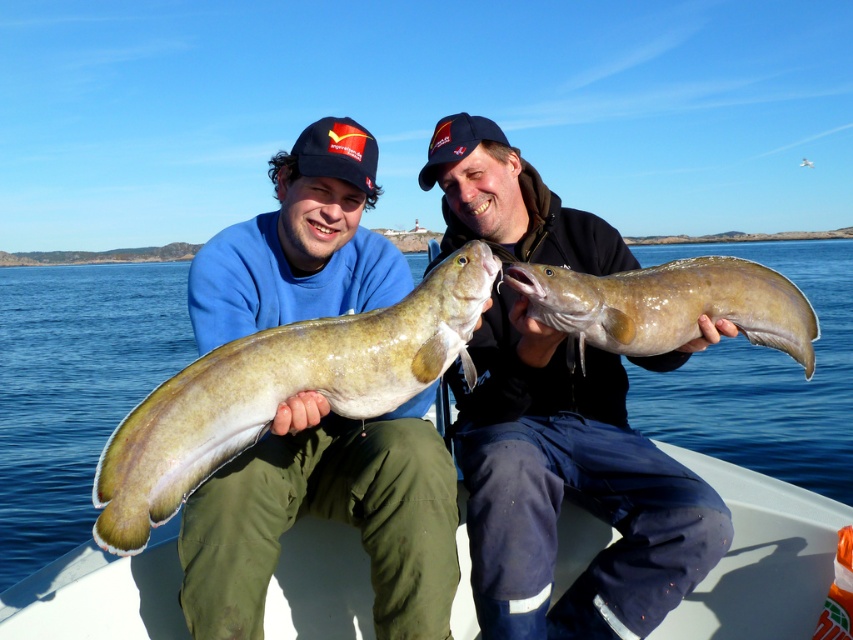
You are standing on the boat and looking towards the front of the boat. Which of the two points, point (526, 179) or point (294, 579), is closer to you?

Point (294, 579) is closer to you because point (526, 179) is behind point (294, 579).

You are standing on the dock and want to board the white plastic boat at lower center. According to the coordinates provided, where should you aim to step onto the boat?

You should aim to step at point (759, 557) to board the white plastic boat at lower center.